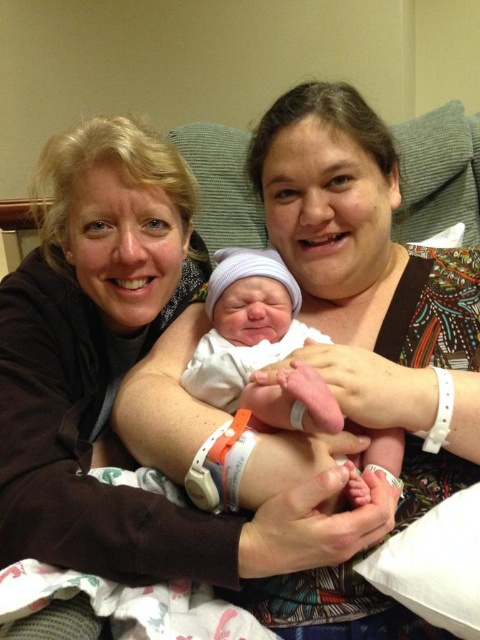
Is matte brown shirt at center behind smooth white swaddle at center?

Yes.

Can you confirm if matte brown shirt at center is positioned below smooth white swaddle at center?

Actually, matte brown shirt at center is above smooth white swaddle at center.

Is point (289, 604) positioned after point (296, 332)?

No, (289, 604) is in front of (296, 332).

Image resolution: width=480 pixels, height=640 pixels. I want to click on matte brown shirt at center, so pos(372,288).